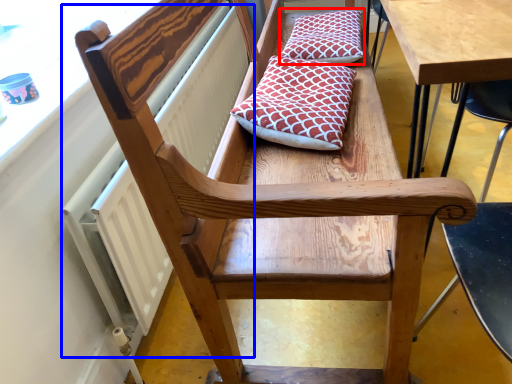
Question: Which object is further to the camera taking this photo, pillow (highlighted by a red box) or radiator (highlighted by a blue box)?

Choices:
 (A) pillow
 (B) radiator

Answer: (A)